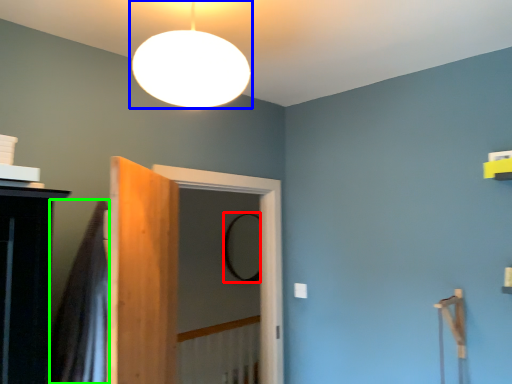
Question: Which is nearer to the mirror (highlighted by a red box)? lamp (highlighted by a blue box) or shower curtain (highlighted by a green box).

Choices:
 (A) lamp
 (B) shower curtain

Answer: (B)